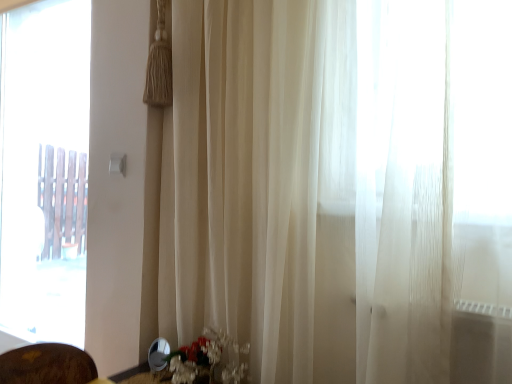
Question: Is translucent glass vase at lower center in contact with transparent glass window at left?

Choices:
 (A) yes
 (B) no

Answer: (B)

Question: Is translucent glass vase at lower center further to camera compared to transparent glass window at left?

Choices:
 (A) no
 (B) yes

Answer: (A)

Question: Does translucent glass vase at lower center have a greater height compared to transparent glass window at left?

Choices:
 (A) yes
 (B) no

Answer: (B)

Question: Is translucent glass vase at lower center at the right side of transparent glass window at left?

Choices:
 (A) yes
 (B) no

Answer: (A)

Question: Considering the relative sizes of translucent glass vase at lower center and transparent glass window at left in the image provided, is translucent glass vase at lower center thinner than transparent glass window at left?

Choices:
 (A) no
 (B) yes

Answer: (A)

Question: Is translucent glass vase at lower center shorter than transparent glass window at left?

Choices:
 (A) yes
 (B) no

Answer: (A)

Question: Is transparent glass window at left outside translucent glass vase at lower center?

Choices:
 (A) yes
 (B) no

Answer: (A)

Question: From a real-world perspective, is transparent glass window at left physically above translucent glass vase at lower center?

Choices:
 (A) yes
 (B) no

Answer: (A)

Question: Considering the relative positions of transparent glass window at left and translucent glass vase at lower center in the image provided, is transparent glass window at left in front of translucent glass vase at lower center?

Choices:
 (A) yes
 (B) no

Answer: (B)

Question: Is transparent glass window at left bigger than translucent glass vase at lower center?

Choices:
 (A) yes
 (B) no

Answer: (A)

Question: Can you confirm if transparent glass window at left is shorter than translucent glass vase at lower center?

Choices:
 (A) yes
 (B) no

Answer: (B)

Question: Is transparent glass window at left facing towards translucent glass vase at lower center?

Choices:
 (A) yes
 (B) no

Answer: (B)

Question: In the image, is transparent glass window at left positioned in front of or behind translucent glass vase at lower center?

Choices:
 (A) behind
 (B) front

Answer: (A)